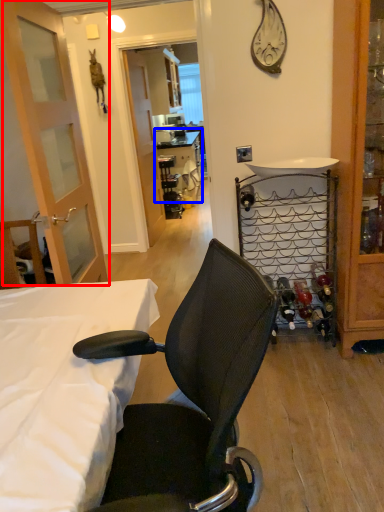
Question: Among these objects, which one is farthest to the camera, door (highlighted by a red box) or table (highlighted by a blue box)?

Choices:
 (A) door
 (B) table

Answer: (B)